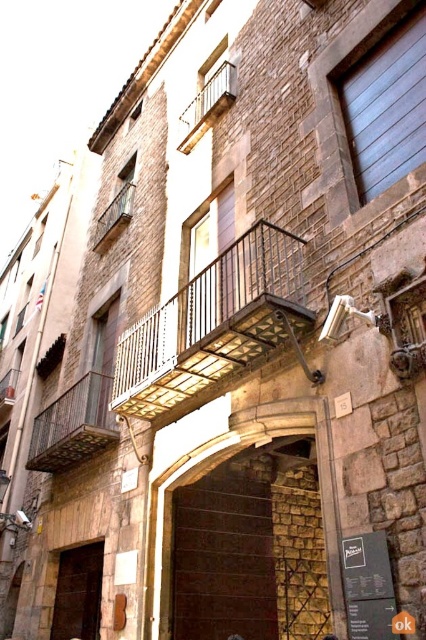
Which is more to the left, wooden at left or rustic wood balcony at center?

wooden at left is more to the left.

Which is in front, point (66, 429) or point (109, 212)?

Positioned in front is point (66, 429).

Locate an element on the screen. Image resolution: width=426 pixels, height=640 pixels. wooden at left is located at coordinates (74, 426).

Does metallic silver balcony at upper center come in front of rustic wood balcony at center?

Yes.

Can you confirm if metallic silver balcony at upper center is positioned to the left of rustic wood balcony at center?

In fact, metallic silver balcony at upper center is to the right of rustic wood balcony at center.

This screenshot has height=640, width=426. What do you see at coordinates (207, 106) in the screenshot? I see `metallic silver balcony at upper center` at bounding box center [207, 106].

Locate an element on the screen. metallic silver balcony at upper center is located at coordinates (207, 106).

What do you see at coordinates (213, 323) in the screenshot? The height and width of the screenshot is (640, 426). I see `metallic wrought iron balcony at center` at bounding box center [213, 323].

Which is above, metallic wrought iron balcony at center or wooden at left?

metallic wrought iron balcony at center is higher up.

You are a GUI agent. You are given a task and a screenshot of the screen. Output one action in this format:
    pyautogui.click(x=<x>, y=<y>)
    Task: Click on the metallic wrought iron balcony at center
    Image resolution: width=426 pixels, height=640 pixels.
    Given the screenshot: What is the action you would take?
    pyautogui.click(x=213, y=323)